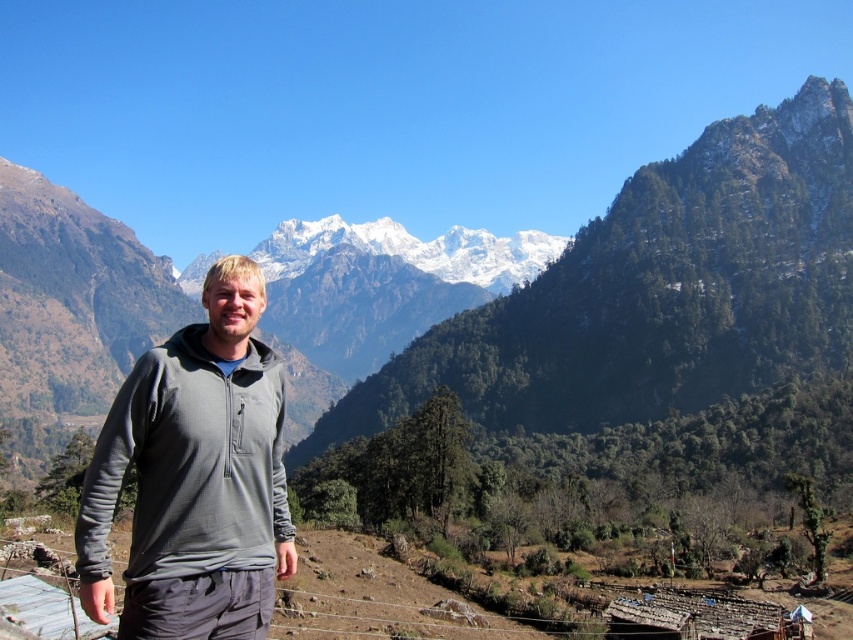
Can you confirm if snowy granite mountain range at upper center is positioned to the left of gray fleece jacket at center?

Correct, you'll find snowy granite mountain range at upper center to the left of gray fleece jacket at center.

Which is behind, point (90, 346) or point (236, 413)?

The point (90, 346) is behind.

The height and width of the screenshot is (640, 853). Find the location of `snowy granite mountain range at upper center`. snowy granite mountain range at upper center is located at coordinates (607, 296).